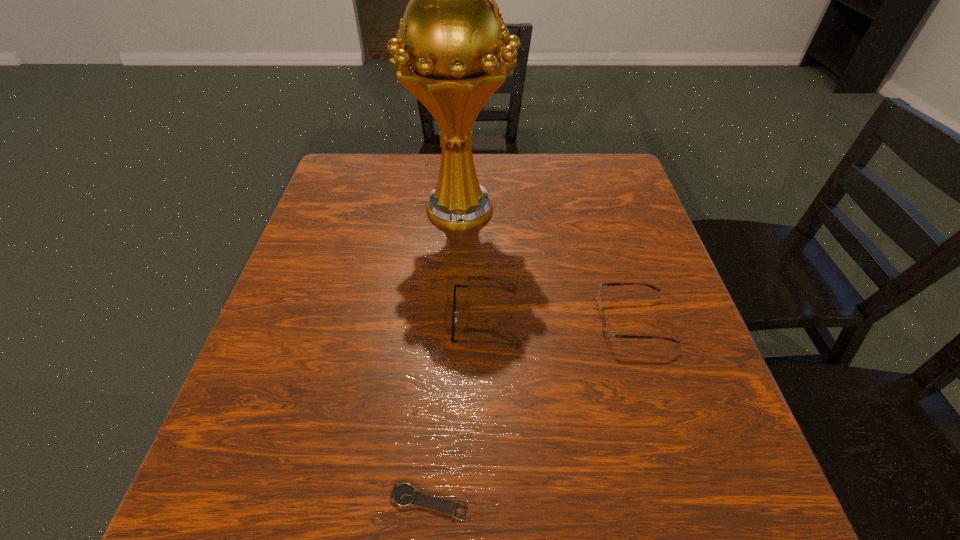
In order to click on vacant point located between the right spectacles and the nearest object in this screenshot , I will do click(531, 411).

Identify the location of free space between the tallest object and the third shortest object. (546, 266).

This screenshot has height=540, width=960. I want to click on free area in between the shortest object and the rightmost object, so click(531, 411).

This screenshot has height=540, width=960. I want to click on free spot between the taller spectacles and the shorter spectacles, so click(x=559, y=321).

The width and height of the screenshot is (960, 540). In order to click on vacant space that is in between the shortest object and the shorter spectacles in this screenshot , I will do `click(457, 411)`.

I want to click on free spot between the left spectacles and the shortest object, so click(457, 411).

I want to click on the closest object to the shortest object, so click(454, 319).

Locate which object is the third closest to the watch. Please provide its 2D coordinates. Your answer should be formatted as a tuple, i.e. [(x, y)], where the tuple contains the x and y coordinates of a point satisfying the conditions above.

[(450, 52)]

At what (x,y) coordinates should I click in order to perform the action: click on free space in the image that satisfies the following two spatial constraints: 1. on the front-facing side of the taller spectacles; 2. on the front side of the shortest object. Please return your answer as a coordinate pair (x, y). This screenshot has width=960, height=540. Looking at the image, I should click on (687, 502).